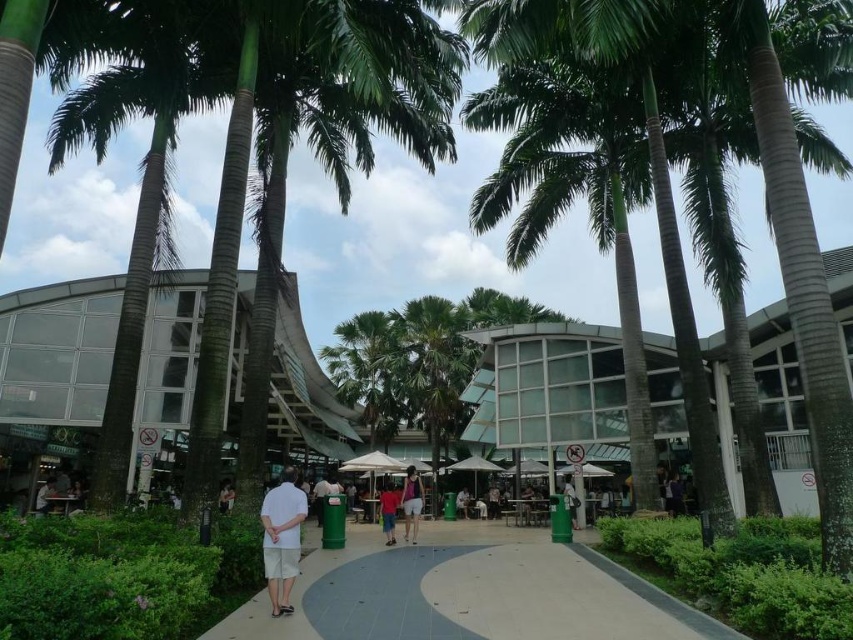
Where is `matte pink shorts at center`? The image size is (853, 640). matte pink shorts at center is located at coordinates (401, 506).

This screenshot has height=640, width=853. What do you see at coordinates (401, 506) in the screenshot?
I see `matte pink shorts at center` at bounding box center [401, 506].

Describe the element at coordinates (401, 506) in the screenshot. The width and height of the screenshot is (853, 640). I see `matte pink shorts at center` at that location.

Where is `matte pink shorts at center`? matte pink shorts at center is located at coordinates (401, 506).

Can you confirm if white cotton shirt at center is wider than bright orange shirt at center?

In fact, white cotton shirt at center might be narrower than bright orange shirt at center.

Does white cotton shirt at center appear on the left side of bright orange shirt at center?

Yes, white cotton shirt at center is to the left of bright orange shirt at center.

Between point (270, 532) and point (381, 518), which one is positioned behind?

Positioned behind is point (381, 518).

Locate an element on the screen. white cotton shirt at center is located at coordinates (282, 540).

Can you confirm if white cotton shorts at center is taller than bright orange shirt at center?

Indeed, white cotton shorts at center has a greater height compared to bright orange shirt at center.

Between white cotton shorts at center and bright orange shirt at center, which one is positioned lower?

white cotton shorts at center is lower down.

Who is more distant from viewer, (418, 484) or (390, 512)?

The point (390, 512) is behind.

You are a GUI agent. You are given a task and a screenshot of the screen. Output one action in this format:
    pyautogui.click(x=<x>, y=<y>)
    Task: Click on the white cotton shorts at center
    
    Given the screenshot: What is the action you would take?
    pyautogui.click(x=410, y=502)